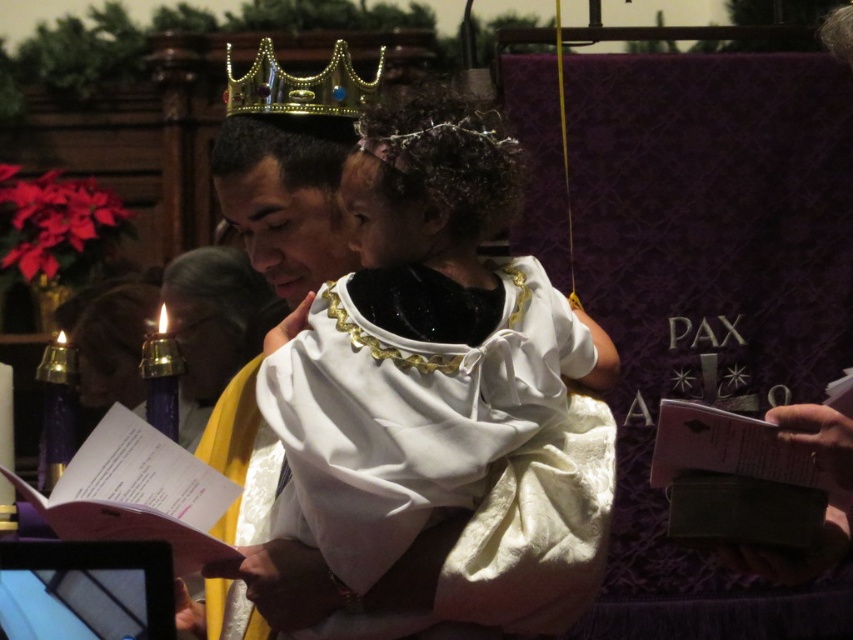
Question: Which of the following is the closest to the observer?

Choices:
 (A) gold jeweled crown at upper center
 (B) white satin dress at center

Answer: (B)

Question: Is white satin dress at center to the right of gold jeweled crown at upper center from the viewer's perspective?

Choices:
 (A) no
 (B) yes

Answer: (B)

Question: Among these points, which one is nearest to the camera?

Choices:
 (A) (225, 108)
 (B) (395, 200)

Answer: (B)

Question: Can you confirm if white satin dress at center is positioned to the left of gold jeweled crown at upper center?

Choices:
 (A) yes
 (B) no

Answer: (B)

Question: Is white satin dress at center to the left of gold jeweled crown at upper center from the viewer's perspective?

Choices:
 (A) no
 (B) yes

Answer: (A)